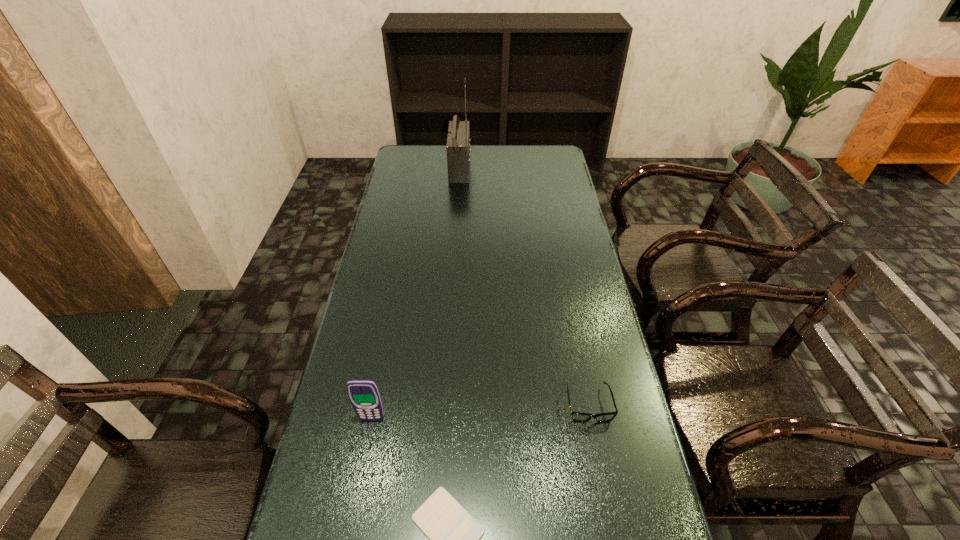
Locate which object ranks second in proximity to the second shortest object. Please provide its 2D coordinates. Your answer should be formatted as a tuple, i.e. [(x, y)], where the tuple contains the x and y coordinates of a point satisfying the conditions above.

[(364, 394)]

Locate an element on the screen. This screenshot has width=960, height=540. blank area in the image that satisfies the following two spatial constraints: 1. on the front panel of the tallest object; 2. on the front-facing side of the leftmost object is located at coordinates (444, 418).

At what (x,y) coordinates should I click in order to perform the action: click on vacant position in the image that satisfies the following two spatial constraints: 1. on the front panel of the farthest object; 2. on the front-facing side of the third shortest object. Please return your answer as a coordinate pair (x, y). Looking at the image, I should click on (444, 418).

Find the location of a particular element. blank area in the image that satisfies the following two spatial constraints: 1. on the front panel of the farthest object; 2. on the front-facing side of the second tallest object is located at coordinates pyautogui.click(x=444, y=418).

Locate an element on the screen. The height and width of the screenshot is (540, 960). free point that satisfies the following two spatial constraints: 1. on the front panel of the farthest object; 2. on the front-facing side of the second tallest object is located at coordinates (444, 418).